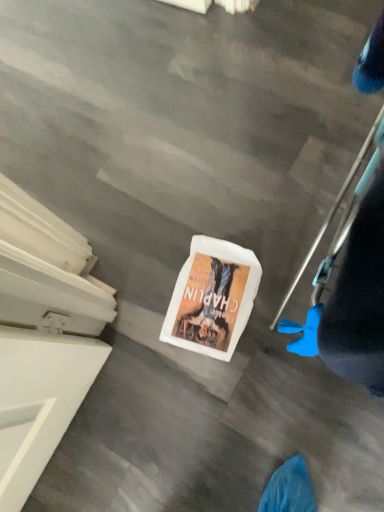
Question: Based on their sizes in the image, would you say blue rubber glove at lower right is bigger or smaller than white matte book at center?

Choices:
 (A) big
 (B) small

Answer: (A)

Question: From a real-world perspective, relative to white matte book at center, is blue rubber glove at lower right vertically above or below?

Choices:
 (A) above
 (B) below

Answer: (A)

Question: In terms of width, does blue rubber glove at lower right look wider or thinner when compared to white matte book at center?

Choices:
 (A) wide
 (B) thin

Answer: (B)

Question: Based on their positions, is white matte book at center located to the left or right of blue rubber glove at lower right?

Choices:
 (A) right
 (B) left

Answer: (B)

Question: Do you think white matte book at center is within blue rubber glove at lower right, or outside of it?

Choices:
 (A) outside
 (B) inside

Answer: (A)

Question: From the image's perspective, relative to blue rubber glove at lower right, is white matte book at center above or below?

Choices:
 (A) below
 (B) above

Answer: (A)

Question: From a real-world perspective, is white matte book at center positioned above or below blue rubber glove at lower right?

Choices:
 (A) above
 (B) below

Answer: (B)